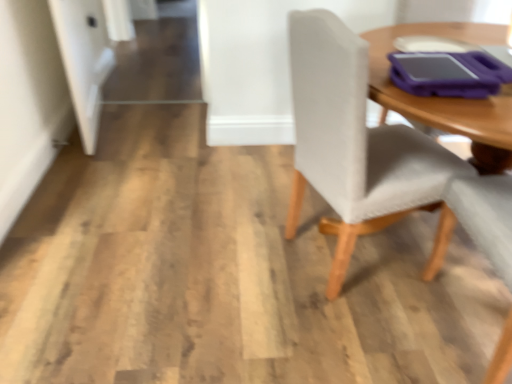
What do you see at coordinates (353, 142) in the screenshot?
I see `light gray fabric chair at right` at bounding box center [353, 142].

The image size is (512, 384). What are the coordinates of `light gray fabric chair at right` in the screenshot? It's located at (353, 142).

Measure the distance between point (x=326, y=26) and camera.

The distance of point (x=326, y=26) from camera is 3.63 feet.

Identify the location of light gray fabric chair at right. (353, 142).